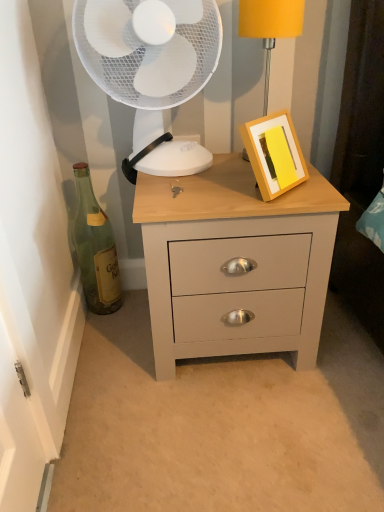
Identify the location of vacant region in front of matte gray chest of drawers at center. The width and height of the screenshot is (384, 512). (231, 434).